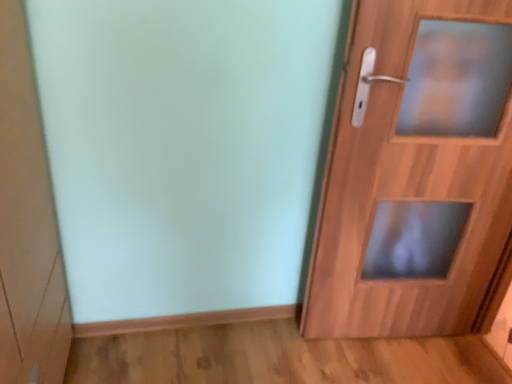
The height and width of the screenshot is (384, 512). Describe the element at coordinates (416, 172) in the screenshot. I see `wooden door at right` at that location.

Measure the distance between point (375, 191) and camera.

A distance of 1.46 meters exists between point (375, 191) and camera.

The image size is (512, 384). Identify the location of wooden door at right. (416, 172).

What is the approximate width of matte white cabinet at left?

matte white cabinet at left is 5.36 centimeters in width.

Describe the element at coordinates (27, 222) in the screenshot. This screenshot has width=512, height=384. I see `matte white cabinet at left` at that location.

Identify the location of matte white cabinet at left. (27, 222).

I want to click on wooden door at right, so click(x=416, y=172).

Is matte white cabinet at left to the right of wooden door at right from the viewer's perspective?

No, matte white cabinet at left is not to the right of wooden door at right.

Does matte white cabinet at left lie behind wooden door at right?

No, the depth of matte white cabinet at left is less than that of wooden door at right.

Is point (15, 49) closer or farther from the camera than point (370, 220)?

Point (15, 49).

From the image's perspective, is matte white cabinet at left on top of wooden door at right?

Incorrect, from the image's perspective, matte white cabinet at left is lower than wooden door at right.

From a real-world perspective, is matte white cabinet at left positioned above or below wooden door at right?

In terms of real-world spatial position, matte white cabinet at left is below wooden door at right.

Is matte white cabinet at left wider or thinner than wooden door at right?

Clearly, matte white cabinet at left has more width compared to wooden door at right.

Which of these two, matte white cabinet at left or wooden door at right, stands taller?

With more height is wooden door at right.

Can you confirm if matte white cabinet at left is bigger than wooden door at right?

Actually, matte white cabinet at left might be smaller than wooden door at right.

Is matte white cabinet at left situated inside wooden door at right or outside?

matte white cabinet at left cannot be found inside wooden door at right.

Is there a large distance between matte white cabinet at left and wooden door at right?

That's right, there is a large distance between matte white cabinet at left and wooden door at right.

Is matte white cabinet at left aimed at wooden door at right?

Yes.

What's the angular difference between matte white cabinet at left and wooden door at right's facing directions?

93.5 degrees separate the facing orientations of matte white cabinet at left and wooden door at right.

The image size is (512, 384). I want to click on door that is above the matte white cabinet at left (from the image's perspective), so click(416, 172).

Based on the photo, does wooden door at right appear on the left side of matte white cabinet at left?

No.

Looking at this image, considering the positions of objects wooden door at right and matte white cabinet at left in the image provided, who is in front, wooden door at right or matte white cabinet at left?

matte white cabinet at left is more forward.

Is point (315, 251) in front of point (47, 295)?

No, (315, 251) is behind (47, 295).

From the image's perspective, is wooden door at right above or below matte white cabinet at left?

Clearly, from the image's perspective, wooden door at right is above matte white cabinet at left.

From a real-world perspective, which object stands above the other?

wooden door at right is physically above.

Looking at this image, between wooden door at right and matte white cabinet at left, which one has larger width?

With larger width is matte white cabinet at left.

Does wooden door at right have a greater height compared to matte white cabinet at left?

Correct, wooden door at right is much taller as matte white cabinet at left.

Can you confirm if wooden door at right is smaller than matte white cabinet at left?

No, wooden door at right is not smaller than matte white cabinet at left.

Is wooden door at right completely or partially outside of matte white cabinet at left?

Yes, wooden door at right is not within matte white cabinet at left.

Is the surface of wooden door at right in direct contact with matte white cabinet at left?

wooden door at right is not next to matte white cabinet at left, and they're not touching.

Is wooden door at right facing towards matte white cabinet at left?

No, wooden door at right is not facing towards matte white cabinet at left.

At what (x,y) coordinates should I click in order to perform the action: click on door that is above the matte white cabinet at left (from the image's perspective). Please return your answer as a coordinate pair (x, y). Looking at the image, I should click on (416, 172).

At what (x,y) coordinates should I click in order to perform the action: click on door located behind the matte white cabinet at left. Please return your answer as a coordinate pair (x, y). This screenshot has height=384, width=512. Looking at the image, I should click on (416, 172).

The height and width of the screenshot is (384, 512). In order to click on cabinetry that appears below the wooden door at right (from a real-world perspective) in this screenshot , I will do `click(27, 222)`.